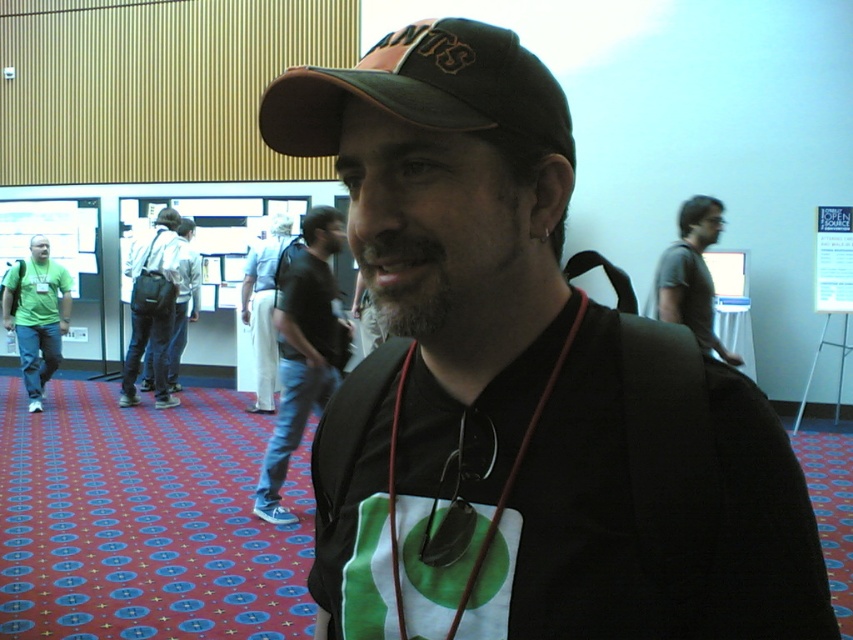
Question: Considering the relative positions of brown fabric cap at upper center and matte black shirt at center in the image provided, where is brown fabric cap at upper center located with respect to matte black shirt at center?

Choices:
 (A) left
 (B) right

Answer: (B)

Question: Which object is positioned farthest from the brown leather lanyard at center?

Choices:
 (A) denim jeans at center
 (B) white cotton pants at center
 (C) brown fabric cap at upper center
 (D) dark blue jeans at center

Answer: (A)

Question: Does white cotton pants at center lie in front of matte black shirt at center?

Choices:
 (A) yes
 (B) no

Answer: (B)

Question: Which object is closer to the camera taking this photo?

Choices:
 (A) brown leather lanyard at center
 (B) gray cotton shirt at center
 (C) matte green t-shirt at left

Answer: (A)

Question: Can you confirm if black matte neck at center is thinner than dark blue jeans at center?

Choices:
 (A) no
 (B) yes

Answer: (B)

Question: Estimate the real-world distances between objects in this image. Which object is farther from the denim jeans at center?

Choices:
 (A) brown fabric cap at upper center
 (B) matte green t-shirt at left

Answer: (A)